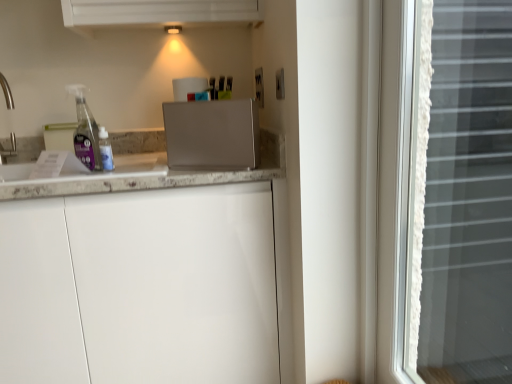
Question: Is white matte cabinet at center far away from white lace curtain at right?

Choices:
 (A) no
 (B) yes

Answer: (A)

Question: Is white matte cabinet at center oriented away from white lace curtain at right?

Choices:
 (A) yes
 (B) no

Answer: (B)

Question: Is white matte cabinet at center smaller than white lace curtain at right?

Choices:
 (A) no
 (B) yes

Answer: (A)

Question: From a real-world perspective, is white matte cabinet at center beneath white lace curtain at right?

Choices:
 (A) yes
 (B) no

Answer: (A)

Question: Is white matte cabinet at center facing towards white lace curtain at right?

Choices:
 (A) yes
 (B) no

Answer: (A)

Question: Based on their sizes in the image, would you say white lace curtain at right is bigger or smaller than satin silver toaster at center?

Choices:
 (A) big
 (B) small

Answer: (A)

Question: Do you think white lace curtain at right is within satin silver toaster at center, or outside of it?

Choices:
 (A) inside
 (B) outside

Answer: (B)

Question: Considering the positions of white lace curtain at right and satin silver toaster at center in the image, is white lace curtain at right wider or thinner than satin silver toaster at center?

Choices:
 (A) wide
 (B) thin

Answer: (B)

Question: Is white lace curtain at right in front of or behind satin silver toaster at center in the image?

Choices:
 (A) front
 (B) behind

Answer: (A)

Question: Visually, is white lace curtain at right positioned to the left or to the right of white marble countertop at left?

Choices:
 (A) right
 (B) left

Answer: (A)

Question: In terms of width, does white lace curtain at right look wider or thinner when compared to white marble countertop at left?

Choices:
 (A) wide
 (B) thin

Answer: (B)

Question: From the image's perspective, is white lace curtain at right positioned above or below white marble countertop at left?

Choices:
 (A) above
 (B) below

Answer: (B)

Question: From a real-world perspective, relative to white marble countertop at left, is white lace curtain at right vertically above or below?

Choices:
 (A) below
 (B) above

Answer: (A)

Question: Would you say satin silver toaster at center is to the left or to the right of white matte cabinet at center in the picture?

Choices:
 (A) right
 (B) left

Answer: (A)

Question: In terms of width, does satin silver toaster at center look wider or thinner when compared to white matte cabinet at center?

Choices:
 (A) thin
 (B) wide

Answer: (A)